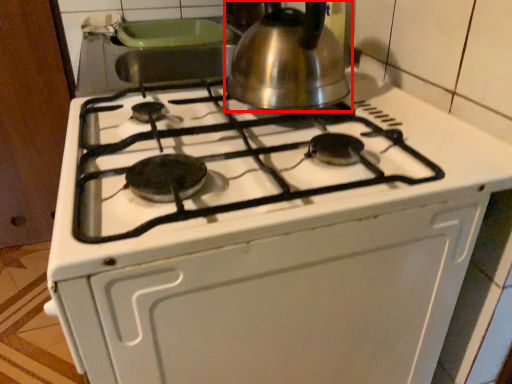
Question: From the image, what is the correct spatial relationship of kettle (annotated by the red box) in relation to oven?

Choices:
 (A) left
 (B) right

Answer: (B)